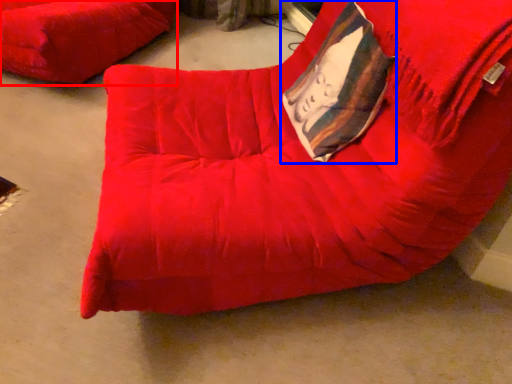
Question: Which object is closer to the camera taking this photo, furniture (highlighted by a red box) or throw pillow (highlighted by a blue box)?

Choices:
 (A) furniture
 (B) throw pillow

Answer: (B)